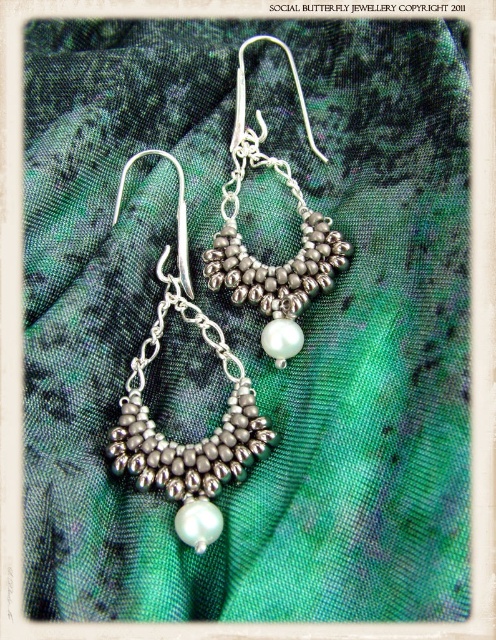
Where is the silver metallic beads at center located in the image?

The silver metallic beads at center are located at point (202, 438) in the image.

In the scene shown: Looking at the earrings displayed on the green fabric, which object has a greater height between the silver metallic beads at center and the silver metallic beaded hoop at center?

The silver metallic beads at center has a greater height compared to the silver metallic beaded hoop at center.

You are an appraiser examining the earrings. You need to determine which part of the earrings has a larger size between the silver metallic beads at center and the silver metallic beaded hoop at center. Which one is larger?

The silver metallic beads at center are larger in size compared to the silver metallic beaded hoop at center.